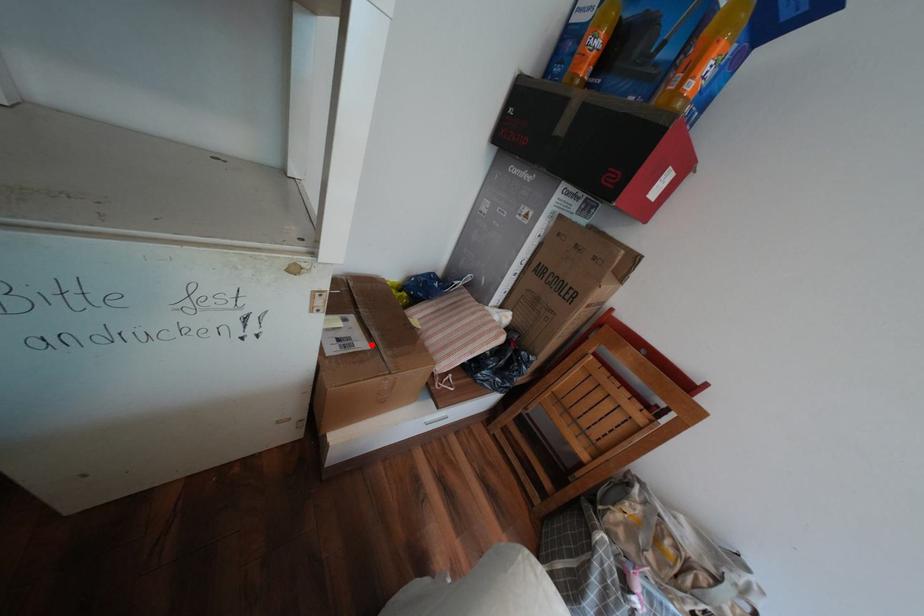
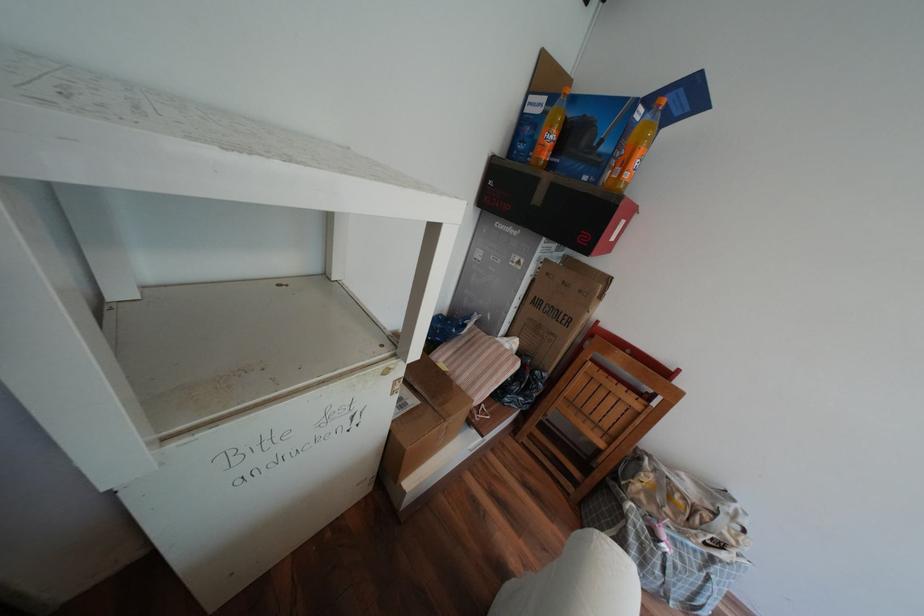
In the second image, find the point that corresponds to the highlighted location in the first image.

(422, 400)